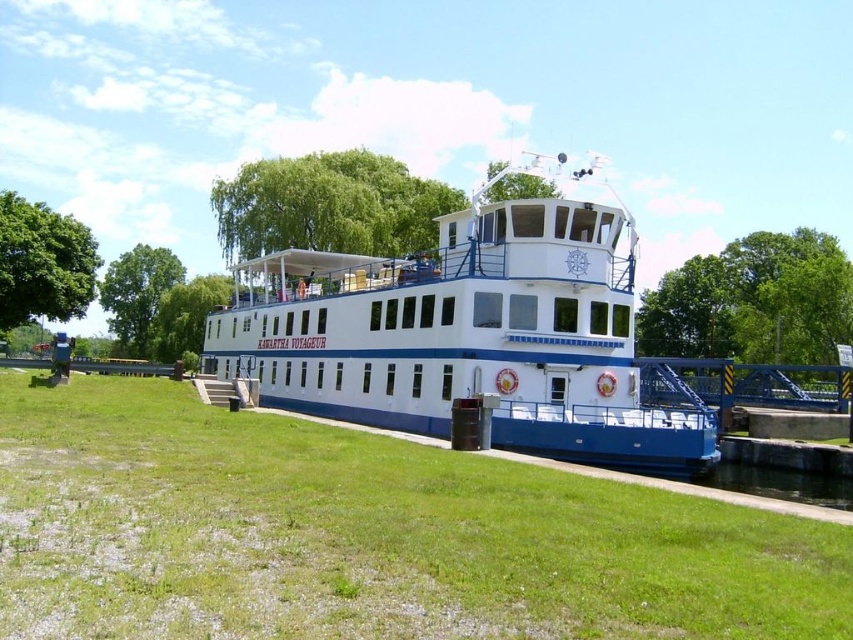
You are a passenger on the Kawartha Voyageur and want to disembark to the grassy area. The walkway is on the opposite side of the boat from the grass. Which direction should you go relative to the green leafy tree at upper left to reach the green grass at lower left?

The green grass at lower left is below the green leafy tree at upper left, so you should head downward from the tree to reach the grass.

You are a photographer planning to take a photo of the white matte boat at center and the green leafy tree at upper left. Based on their heights, which object should you focus on first if you want to ensure both are in frame without needing to adjust your camera angle?

The white matte boat at center is not as tall as the green leafy tree at upper left, so you should focus on the green leafy tree at upper left first to ensure both fit in the frame.

You are standing on the dock next to the Kawartha Voyageur riverboat and want to take a photo of both the green grass at lower left and the green leafy tree at upper left. Which object should you focus on first to ensure both are in clear view?

You should focus on the green grass at lower left first because it is closer to you than the green leafy tree at upper left, ensuring both are in focus as the tree is further away.